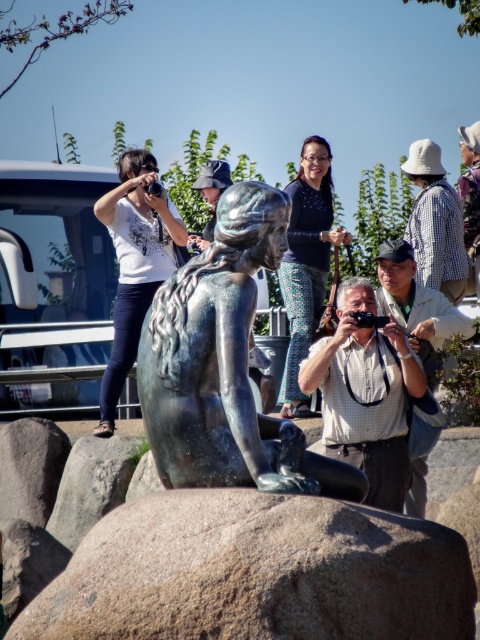
You are standing in the scene and want to take a photo of the bronze statue of a mermaid seated on a rock. There is a person wearing a white checkered shirt at upper right. Where should you stand to avoid blocking the statue with this person?

To avoid blocking the bronze statue of a mermaid seated on a rock with the person wearing a white checkered shirt at upper right, you should position yourself to the left of the person since they are located at the upper right corner of the frame.

You are a photographer trying to capture the bronze statue of a mermaid seated on a rock. You notice two people in front of you wearing a checkered shirt camera at center and a plaid shirt at center. Which person is shorter in height?

The checkered shirt camera at center has a lesser height compared to plaid shirt at center, so the person wearing the checkered shirt camera at center is shorter.

You are standing in front of the bronze statue of a mermaid seated on a rock. You notice two points marked in the scene, one at coordinates point (x=63, y=573) and the other at point (x=442, y=332). Which of these two points is nearer to you?

Point (x=63, y=573) is closer to the camera than point (x=442, y=332), so the point at coordinates point (x=63, y=573) is nearer to you.